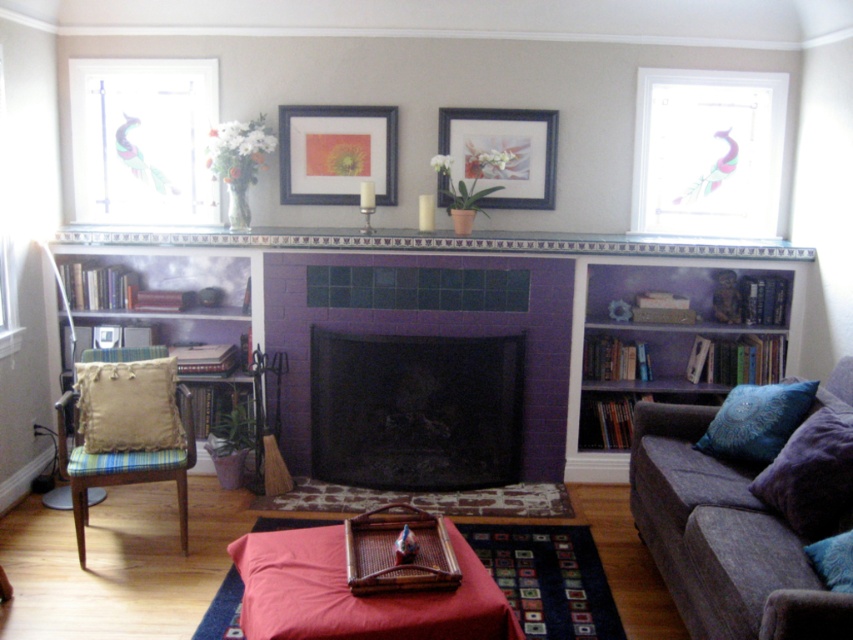
Question: Observing the image, what is the correct spatial positioning of beige fabric cushioned chair at left in reference to teal velvet cushion at right?

Choices:
 (A) left
 (B) right

Answer: (A)

Question: Can you confirm if dark gray fabric couch at lower right is bigger than purple matte bookshelf at right?

Choices:
 (A) no
 (B) yes

Answer: (B)

Question: Estimate the real-world distances between objects in this image. Which object is farther from the white glossy tile at upper center?

Choices:
 (A) stained glass peacock at upper right
 (B) purple tile fireplace at center

Answer: (A)

Question: Which object is closer to the camera taking this photo?

Choices:
 (A) matte black picture frame at upper center
 (B) stained glass peacock at upper left
 (C) beige fabric pillow at left
 (D) teal velvet cushion at right

Answer: (D)

Question: Can you confirm if stained glass peacock at upper left is wider than purple velvet pillow at lower right?

Choices:
 (A) yes
 (B) no

Answer: (A)

Question: Considering the real-world distances, which object is closest to the matte black picture frame at upper center?

Choices:
 (A) black mesh fireplace at center
 (B) blue textured pillow at lower right

Answer: (A)